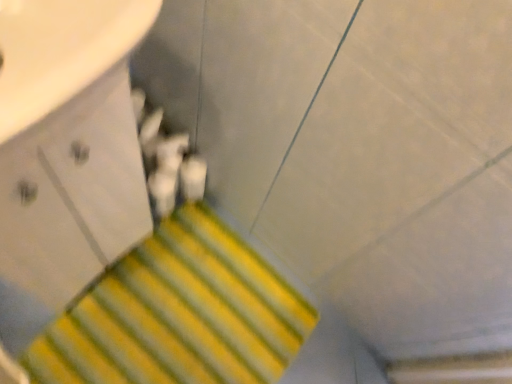
Question: Is white glossy drawer at upper left to the left or to the right of yellow striped carpet at lower center in the image?

Choices:
 (A) right
 (B) left

Answer: (B)

Question: Is point (113, 139) positioned closer to the camera than point (167, 380)?

Choices:
 (A) farther
 (B) closer

Answer: (B)

Question: Looking at their shapes, would you say white glossy drawer at upper left is wider or thinner than yellow striped carpet at lower center?

Choices:
 (A) thin
 (B) wide

Answer: (A)

Question: Is yellow striped carpet at lower center taller or shorter than white glossy drawer at upper left?

Choices:
 (A) short
 (B) tall

Answer: (A)

Question: Based on their sizes in the image, would you say yellow striped carpet at lower center is bigger or smaller than white glossy drawer at upper left?

Choices:
 (A) big
 (B) small

Answer: (B)

Question: In the image, is yellow striped carpet at lower center on the left side or the right side of white glossy drawer at upper left?

Choices:
 (A) right
 (B) left

Answer: (A)

Question: Considering the positions of point (160, 322) and point (36, 278), is point (160, 322) closer or farther from the camera than point (36, 278)?

Choices:
 (A) closer
 (B) farther

Answer: (B)